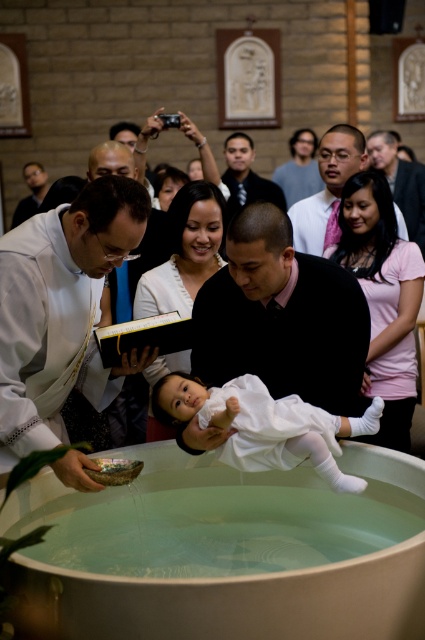
Question: Is white matte baby at center positioned before gray sweater at upper center?

Choices:
 (A) no
 (B) yes

Answer: (B)

Question: Is the position of black matte shirt at center less distant than that of matte black robe at upper left?

Choices:
 (A) yes
 (B) no

Answer: (A)

Question: Among these points, which one is nearest to the camera?

Choices:
 (A) (258, 461)
 (B) (227, 145)
 (C) (285, 182)
 (D) (419, 204)

Answer: (A)

Question: Which of the following is the closest to the observer?

Choices:
 (A) (85, 276)
 (B) (312, 248)
 (C) (303, 168)

Answer: (A)

Question: Considering the real-world distances, which object is closest to the gray sweater at upper center?

Choices:
 (A) pink satin tie at upper center
 (B) white matte baby at center
 (C) white clothed priest at left
 (D) smooth black shirt at upper right

Answer: (D)

Question: Is pink satin tie at upper center to the left of gray sweater at upper center from the viewer's perspective?

Choices:
 (A) yes
 (B) no

Answer: (A)